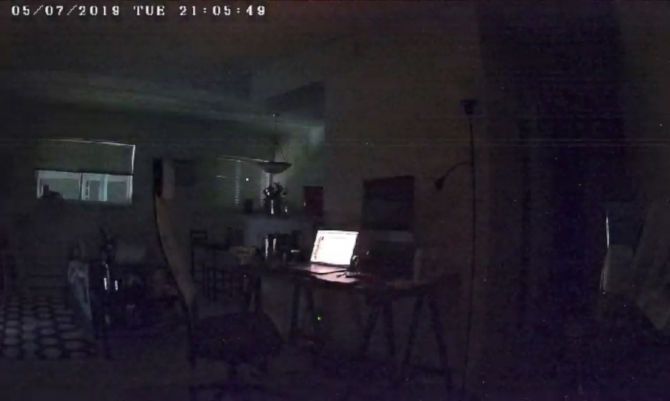
The height and width of the screenshot is (401, 670). What are the coordinates of `lamp` in the screenshot? It's located at (470, 164).